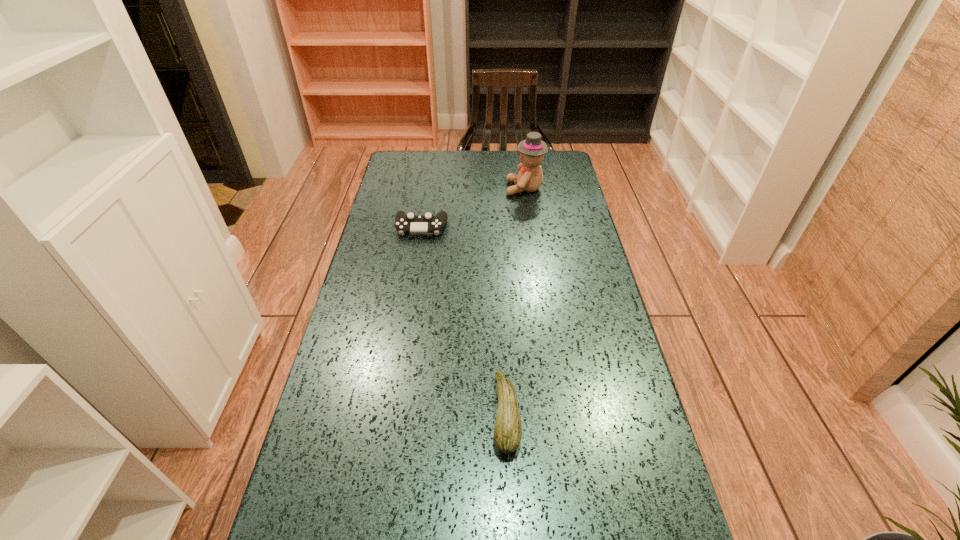
Find the location of a particular element. The image size is (960, 540). the tallest object is located at coordinates 531,150.

Locate an element on the screen. The image size is (960, 540). the rightmost object is located at coordinates (531, 150).

Where is `the second nearest object`? This screenshot has width=960, height=540. the second nearest object is located at coordinates click(410, 223).

The height and width of the screenshot is (540, 960). What are the coordinates of `the leftmost object` in the screenshot? It's located at (410, 223).

Where is `zucchini`? zucchini is located at coordinates (508, 430).

At what (x,y) coordinates should I click in order to perform the action: click on the second object from left to right. Please return your answer as a coordinate pair (x, y). Looking at the image, I should click on (508, 430).

The width and height of the screenshot is (960, 540). In order to click on vacant region located 0.350m on the front-facing side of the rightmost object in this screenshot , I will do `click(418, 188)`.

The height and width of the screenshot is (540, 960). I want to click on vacant space located 0.350m on the front-facing side of the rightmost object, so click(x=418, y=188).

What are the coordinates of `vacant space located 0.340m on the front-facing side of the rightmost object` in the screenshot? It's located at (420, 188).

Where is `vacant area located 0.170m on the surface of the second farthest object`? This screenshot has height=540, width=960. vacant area located 0.170m on the surface of the second farthest object is located at coordinates (414, 272).